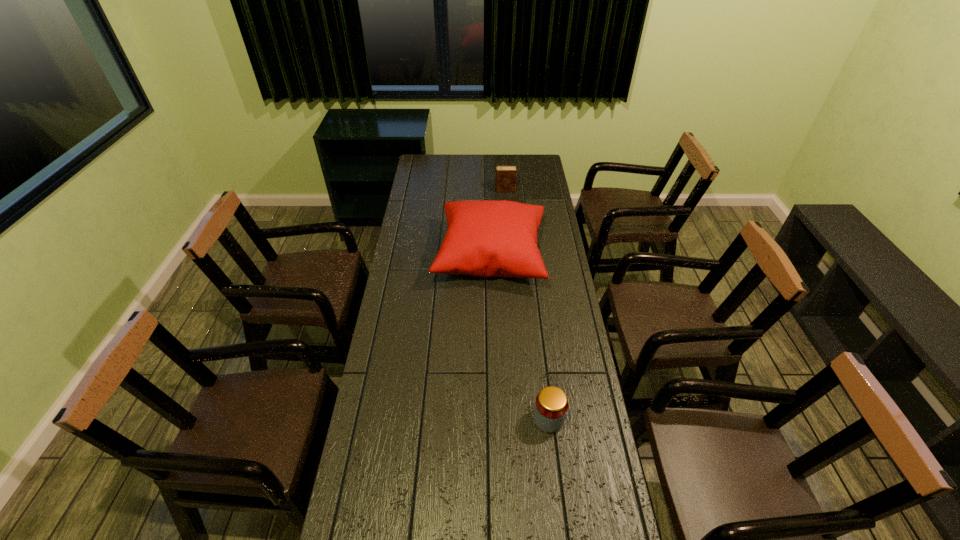
Image resolution: width=960 pixels, height=540 pixels. Identify the location of jar located in the right edge section of the desktop. (551, 404).

In the image, there is a desktop. Find the location of `vacant space at the far edge`. vacant space at the far edge is located at coordinates (446, 161).

Identify the location of free space at the left edge. (408, 402).

In the image, there is a desktop. Where is `free space at the right edge`? Image resolution: width=960 pixels, height=540 pixels. free space at the right edge is located at coordinates (545, 260).

Find the location of a particular element. This screenshot has height=540, width=960. vacant area at the far right corner is located at coordinates (537, 164).

Find the location of a particular element. This screenshot has width=960, height=540. free space between the diary and the jar is located at coordinates (527, 305).

The height and width of the screenshot is (540, 960). What are the coordinates of `empty space between the farthest object and the jar` in the screenshot? It's located at (527, 305).

You are a GUI agent. You are given a task and a screenshot of the screen. Output one action in this format:
    pyautogui.click(x=<x>, y=<y>)
    Task: Click on the free area in between the diary and the nearest object
    The image size is (960, 540).
    Given the screenshot: What is the action you would take?
    pyautogui.click(x=527, y=305)

Locate an element on the screen. Image resolution: width=960 pixels, height=540 pixels. vacant space in between the jar and the cushion is located at coordinates (519, 338).

Identify the location of free space that is in between the nearest object and the farthest object. (527, 305).